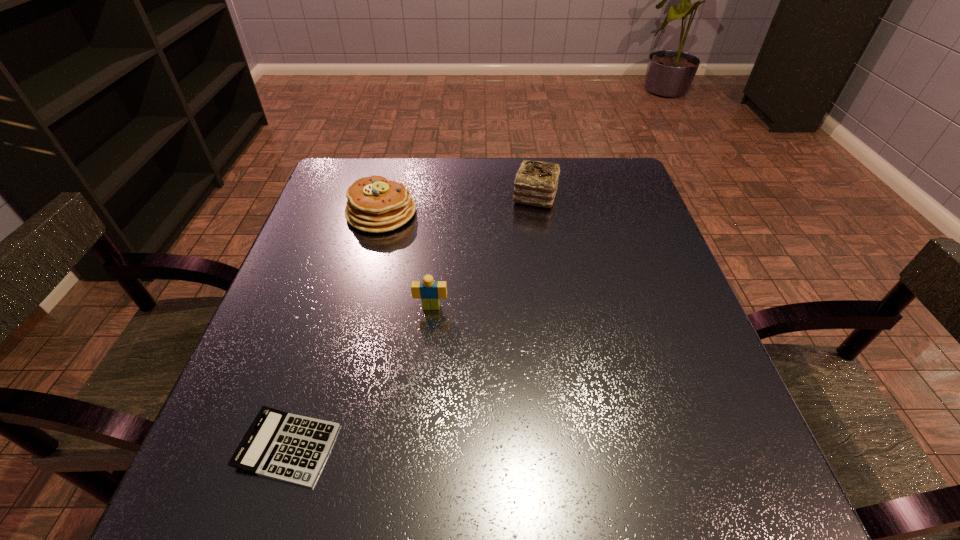
Locate an element on the screen. the rightmost object is located at coordinates (536, 182).

Find the location of a particular element. Image resolution: width=960 pixels, height=540 pixels. pancake is located at coordinates (374, 204).

Locate an element on the screen. the third object from left to right is located at coordinates (429, 291).

Locate an element on the screen. The height and width of the screenshot is (540, 960). the second nearest object is located at coordinates (429, 291).

The image size is (960, 540). In order to click on calculator in this screenshot , I will do `click(287, 447)`.

The height and width of the screenshot is (540, 960). In order to click on the shortest object in this screenshot , I will do `click(287, 447)`.

Find the location of a particular element. vacant space located 0.350m on the left of the rightmost object is located at coordinates (377, 197).

At what (x,y) coordinates should I click in order to perform the action: click on free region located 0.340m on the front of the pancake. Please return your answer as a coordinate pair (x, y). This screenshot has width=960, height=540. Looking at the image, I should click on (344, 356).

This screenshot has height=540, width=960. In order to click on free space located 0.120m on the face of the third farthest object in this screenshot , I will do `click(425, 362)`.

The height and width of the screenshot is (540, 960). I want to click on free region located 0.290m on the back of the calculator, so click(339, 283).